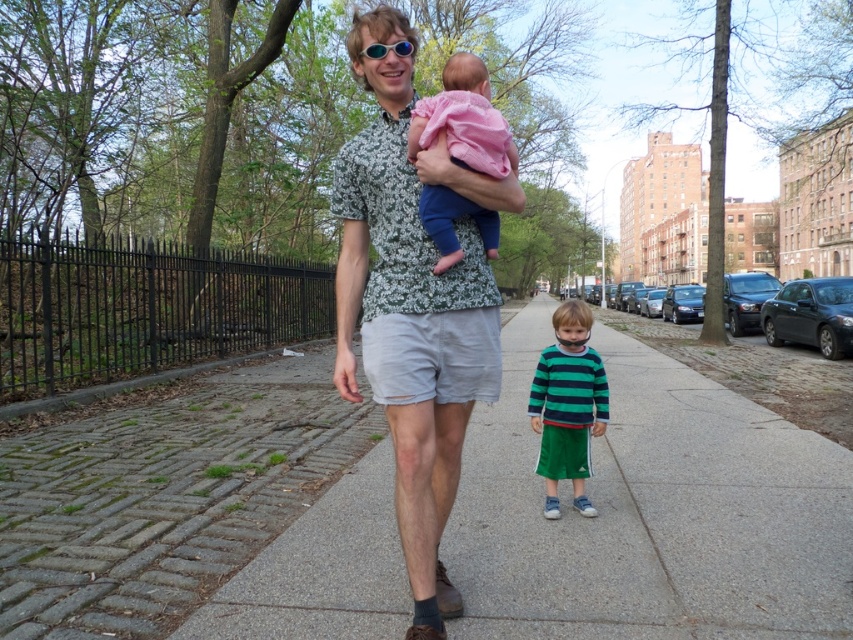
Question: Which point appears farthest from the camera in this image?

Choices:
 (A) (527, 440)
 (B) (438, 109)

Answer: (A)

Question: In this image, where is pink soft fabric baby at center located relative to green striped shirt at center?

Choices:
 (A) below
 (B) above

Answer: (B)

Question: Is gray concrete sidewalk at center positioned in front of green striped shirt at center?

Choices:
 (A) yes
 (B) no

Answer: (A)

Question: Estimate the real-world distances between objects in this image. Which object is closer to the floral-patterned shirt at center?

Choices:
 (A) sunglasses at center
 (B) green striped shirt at center

Answer: (A)

Question: Which point is closer to the camera?

Choices:
 (A) floral-patterned shirt at center
 (B) gray concrete sidewalk at center

Answer: (A)

Question: Is pink soft fabric baby at center to the left of green striped shirt at center from the viewer's perspective?

Choices:
 (A) yes
 (B) no

Answer: (A)